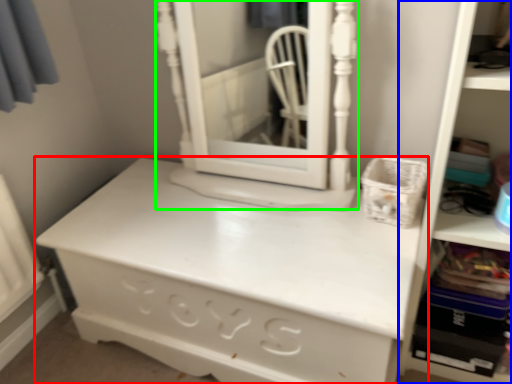
Question: Which object is the closest to the chest of drawers (highlighted by a red box)? Choose among these: bookshelf (highlighted by a blue box) or medicine cabinet (highlighted by a green box).

Choices:
 (A) bookshelf
 (B) medicine cabinet

Answer: (A)